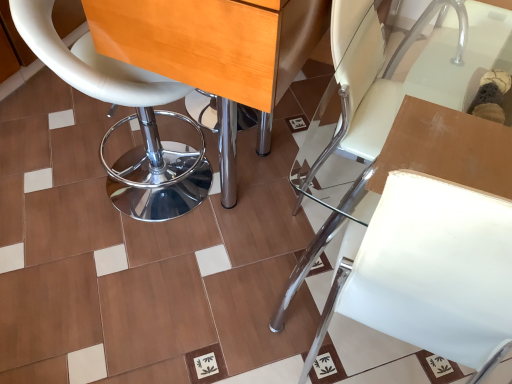
Question: Would you say white leather stool at left, placed as the first chair when sorted from left to right, is to the left or to the right of wooden table at center in the picture?

Choices:
 (A) right
 (B) left

Answer: (B)

Question: Looking at the image, does white leather stool at left, which is the 2th chair from right to left, seem bigger or smaller compared to wooden table at center?

Choices:
 (A) big
 (B) small

Answer: (B)

Question: Which of these objects is positioned closest to the white leather chair at center, the first chair in the right-to-left sequence?

Choices:
 (A) white leather stool at left, placed as the first chair when sorted from left to right
 (B) wooden table at center

Answer: (B)

Question: Estimate the real-world distances between objects in this image. Which object is closer to the white leather chair at center, placed as the 2th chair when sorted from left to right?

Choices:
 (A) wooden table at center
 (B) white leather stool at left, placed as the first chair when sorted from left to right

Answer: (A)